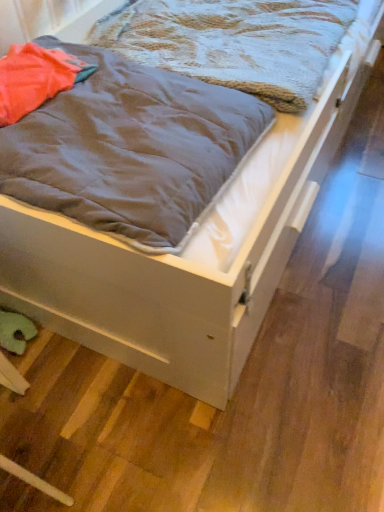
Question: In which direction should I rotate to look at gray matte blanket at center, positioned as the first blanket in front-to-back order?

Choices:
 (A) right
 (B) left

Answer: (B)

Question: Can you confirm if textured gray blanket at upper left, the 1th blanket positioned from the back, is bigger than gray matte blanket at center, the second blanket when ordered from back to front?

Choices:
 (A) no
 (B) yes

Answer: (B)

Question: Can you see textured gray blanket at upper left, the 2th blanket from the front, touching gray matte blanket at center, the second blanket when ordered from back to front?

Choices:
 (A) yes
 (B) no

Answer: (B)

Question: From a real-world perspective, is textured gray blanket at upper left, the 2th blanket from the front, physically below gray matte blanket at center, the second blanket when ordered from back to front?

Choices:
 (A) no
 (B) yes

Answer: (B)

Question: Is gray matte blanket at center, the second blanket when ordered from back to front, a part of textured gray blanket at upper left, the 2th blanket from the front?

Choices:
 (A) no
 (B) yes

Answer: (A)

Question: Can you confirm if textured gray blanket at upper left, the 2th blanket from the front, is taller than gray matte blanket at center, positioned as the first blanket in front-to-back order?

Choices:
 (A) no
 (B) yes

Answer: (A)

Question: Does textured gray blanket at upper left, the 1th blanket positioned from the back, come behind gray matte blanket at center, the second blanket when ordered from back to front?

Choices:
 (A) yes
 (B) no

Answer: (A)

Question: From a real-world perspective, is gray matte blanket at center, positioned as the first blanket in front-to-back order, located beneath textured gray blanket at upper left, the 2th blanket from the front?

Choices:
 (A) yes
 (B) no

Answer: (B)

Question: Would you say gray matte blanket at center, positioned as the first blanket in front-to-back order, contains textured gray blanket at upper left, the 2th blanket from the front?

Choices:
 (A) no
 (B) yes

Answer: (A)

Question: Is gray matte blanket at center, the second blanket when ordered from back to front, at the left side of textured gray blanket at upper left, the 2th blanket from the front?

Choices:
 (A) no
 (B) yes

Answer: (B)

Question: Considering the relative sizes of gray matte blanket at center, positioned as the first blanket in front-to-back order, and textured gray blanket at upper left, the 2th blanket from the front, in the image provided, is gray matte blanket at center, positioned as the first blanket in front-to-back order, taller than textured gray blanket at upper left, the 2th blanket from the front,?

Choices:
 (A) yes
 (B) no

Answer: (A)

Question: Is gray matte blanket at center, positioned as the first blanket in front-to-back order, shorter than textured gray blanket at upper left, the 2th blanket from the front?

Choices:
 (A) yes
 (B) no

Answer: (B)

Question: Does gray matte blanket at center, positioned as the first blanket in front-to-back order, turn towards textured gray blanket at upper left, the 2th blanket from the front?

Choices:
 (A) yes
 (B) no

Answer: (B)

Question: Looking at the image, does gray matte blanket at center, positioned as the first blanket in front-to-back order, seem bigger or smaller compared to textured gray blanket at upper left, the 1th blanket positioned from the back?

Choices:
 (A) small
 (B) big

Answer: (A)